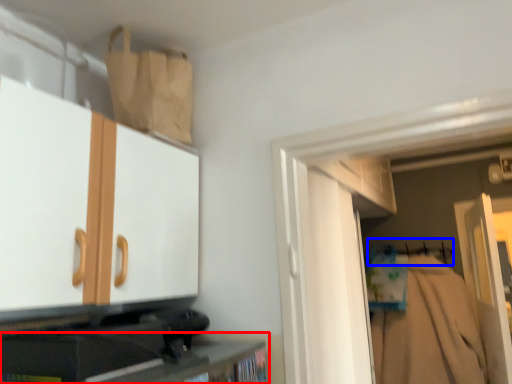
Question: Which object is closer to the camera taking this photo, cabinetry (highlighted by a red box) or hanger (highlighted by a blue box)?

Choices:
 (A) cabinetry
 (B) hanger

Answer: (A)